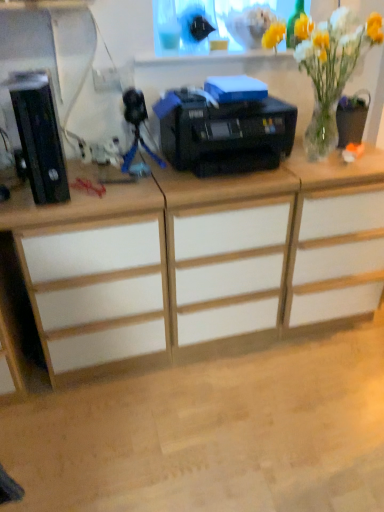
Question: Is blue plastic tripod at center positioned before white matte desk at left?

Choices:
 (A) no
 (B) yes

Answer: (A)

Question: From a real-world perspective, is blue plastic tripod at center below white matte desk at left?

Choices:
 (A) no
 (B) yes

Answer: (A)

Question: Is blue plastic tripod at center not close to white matte desk at left?

Choices:
 (A) yes
 (B) no

Answer: (B)

Question: Considering the relative sizes of blue plastic tripod at center and white matte desk at left in the image provided, is blue plastic tripod at center wider than white matte desk at left?

Choices:
 (A) yes
 (B) no

Answer: (B)

Question: Is blue plastic tripod at center directly adjacent to white matte desk at left?

Choices:
 (A) yes
 (B) no

Answer: (B)

Question: Is blue plastic tripod at center positioned beyond the bounds of white matte desk at left?

Choices:
 (A) yes
 (B) no

Answer: (A)

Question: From a real-world perspective, does blue plastic tripod at center sit lower than black plastic computer tower at left?

Choices:
 (A) no
 (B) yes

Answer: (B)

Question: Can you confirm if blue plastic tripod at center is shorter than black plastic computer tower at left?

Choices:
 (A) yes
 (B) no

Answer: (A)

Question: Does blue plastic tripod at center have a greater height compared to black plastic computer tower at left?

Choices:
 (A) yes
 (B) no

Answer: (B)

Question: Does blue plastic tripod at center have a greater width compared to black plastic computer tower at left?

Choices:
 (A) no
 (B) yes

Answer: (A)

Question: Is blue plastic tripod at center smaller than black plastic computer tower at left?

Choices:
 (A) no
 (B) yes

Answer: (B)

Question: Considering the relative positions of blue plastic tripod at center and black plastic computer tower at left in the image provided, is blue plastic tripod at center to the right of black plastic computer tower at left from the viewer's perspective?

Choices:
 (A) yes
 (B) no

Answer: (A)

Question: Can you confirm if translucent glass vase at upper right is shorter than blue plastic tripod at center?

Choices:
 (A) no
 (B) yes

Answer: (A)